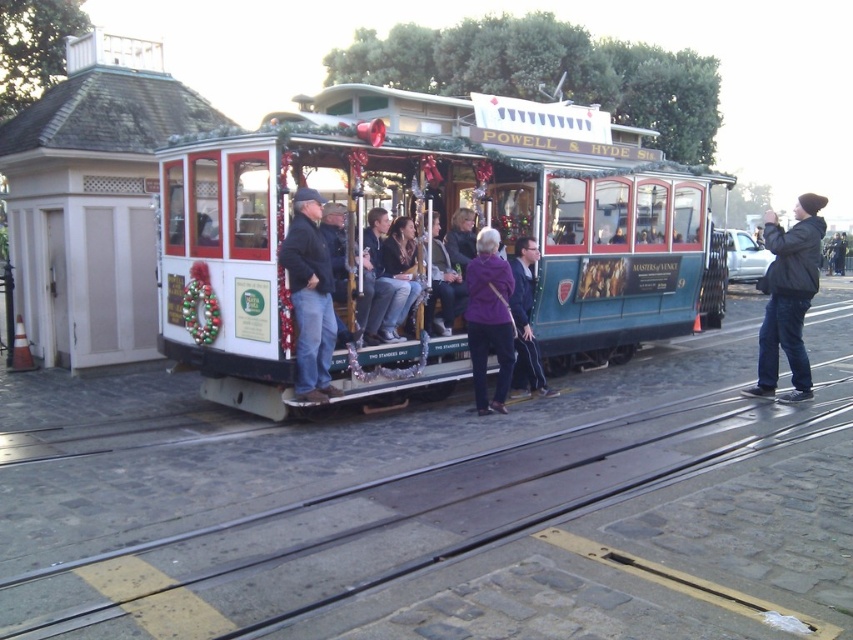
You are standing in front of the Powell and Hyde Street cable car and want to take a photo. You notice two points marked on the car. The first point is at coordinate point (300,355) and the second point is at coordinate point (485,257). Which point will appear larger in your photo?

Point (300,355) is closer to the camera than point (485,257). Since objects closer to the camera appear larger in a photo, the first point will look bigger in your photo.

You are a tour guide leading a group of tourists on a San Francisco cable car ride. You notice two passengers wearing a denim jacket at center and a purple fabric coat at center. The cable car has a narrow aisle between the seats. If the aisle is 1.8 meters wide, can both passengers walk through the aisle side by side without touching each other?

The distance between the denim jacket at center and purple fabric coat at center is 1.74 meters. Since the aisle is 1.8 meters wide, there is enough space for both passengers to walk through side by side without touching each other.

You are standing on the cobblestone street in front of the Powell and Hyde Street Cable Car. You see a polished wood cable car at center and a purple fabric coat at center. Which object is positioned to the right from your perspective?

The polished wood cable car at center is to the right of the purple fabric coat at center from your perspective.